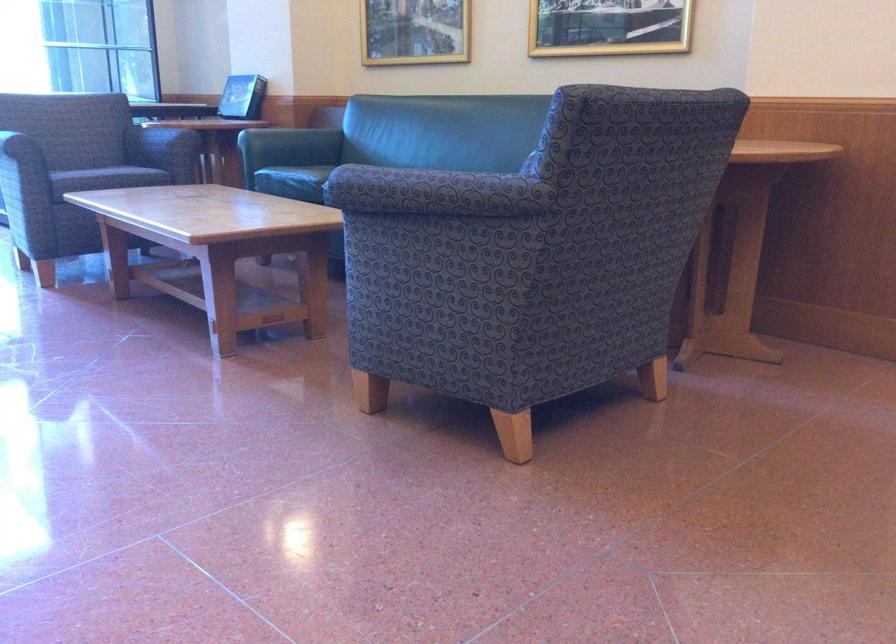
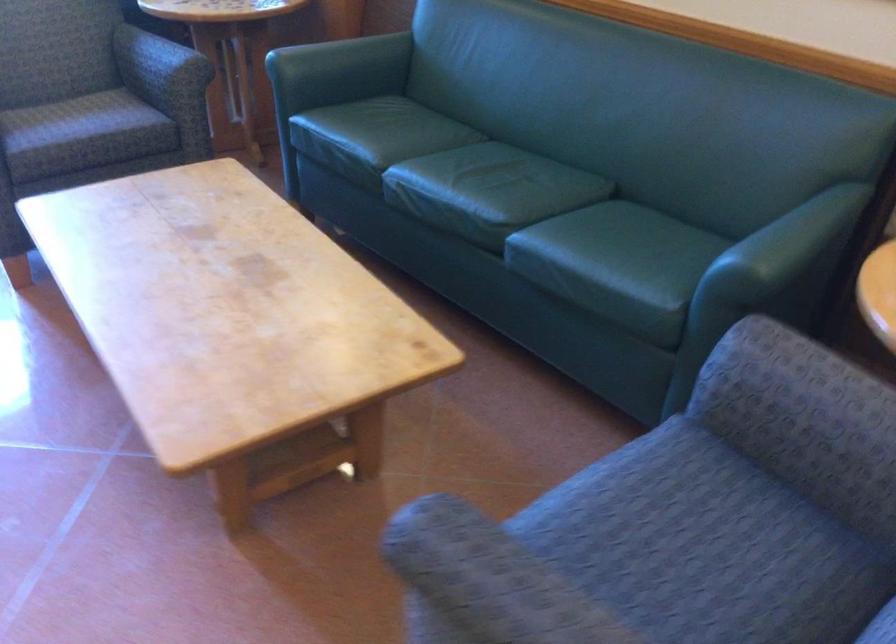
Question: The images are taken continuously from a first-person perspective. In which direction are you moving?

Choices:
 (A) Left
 (B) Right
 (C) Forward
 (D) Backward

Answer: (C)